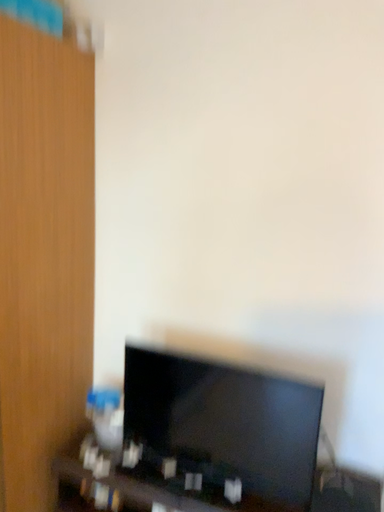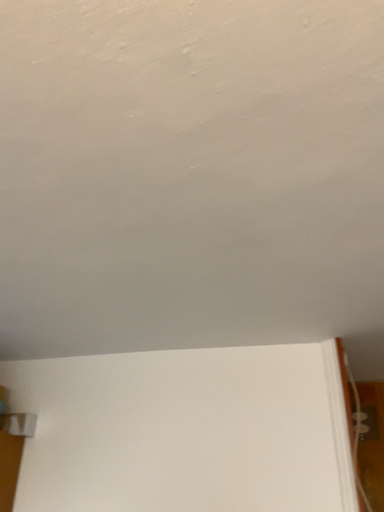
Question: How did the camera likely rotate when shooting the video?

Choices:
 (A) rotated downward
 (B) rotated upward

Answer: (B)